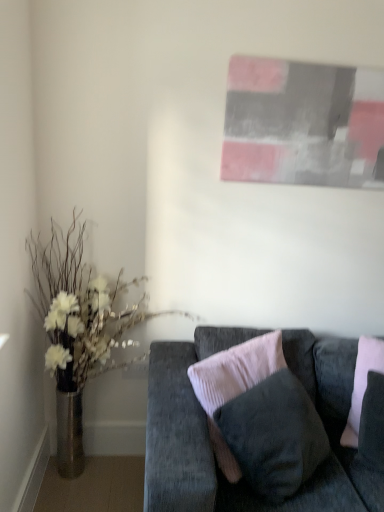
Question: Based on their positions, is metallic vase at left located to the left or right of velvet pink pillow at center?

Choices:
 (A) right
 (B) left

Answer: (B)

Question: From a real-world perspective, relative to velvet pink pillow at center, is metallic vase at left vertically above or below?

Choices:
 (A) above
 (B) below

Answer: (A)

Question: Which is farther from the metallic vase at left?

Choices:
 (A) velvet pink pillow at center
 (B) velvet dark gray couch at lower right

Answer: (A)

Question: Based on their relative distances, which object is nearer to the metallic vase at left?

Choices:
 (A) velvet dark gray couch at lower right
 (B) velvet pink pillow at center

Answer: (A)